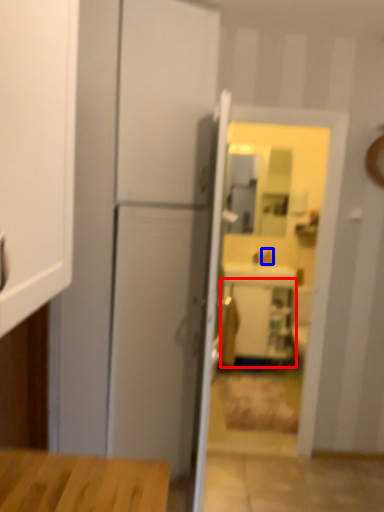
Question: Which point is closer to the camera, cabinetry (highlighted by a red box) or faucet (highlighted by a blue box)?

Choices:
 (A) cabinetry
 (B) faucet

Answer: (A)